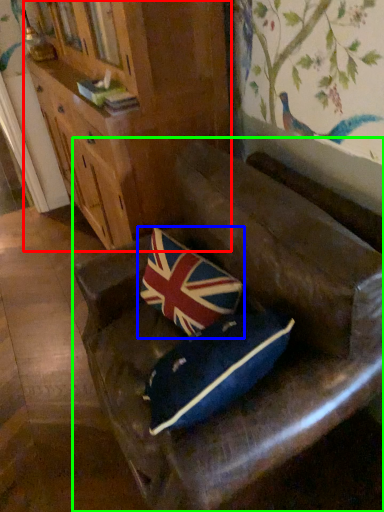
Question: Estimate the real-world distances between objects in this image. Which object is closer to cabinetry (highlighted by a red box), pillow (highlighted by a blue box) or furniture (highlighted by a green box)?

Choices:
 (A) pillow
 (B) furniture

Answer: (A)